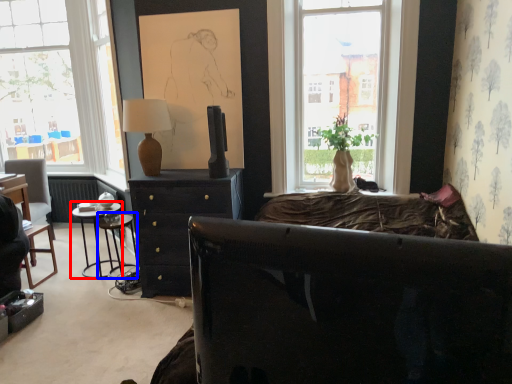
Question: Which of the following is the closest to the observer, nightstand (highlighted by a red box) or bar stool (highlighted by a blue box)?

Choices:
 (A) nightstand
 (B) bar stool

Answer: (B)